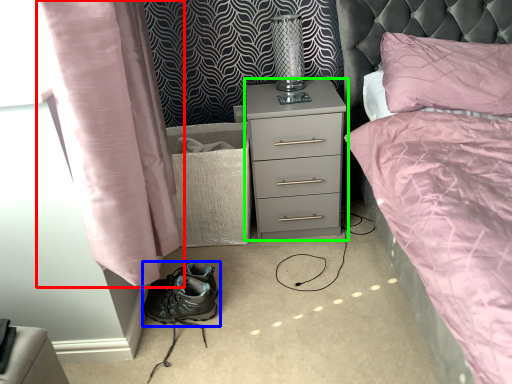
Question: Which object is positioned farthest from curtain (highlighted by a red box)? Select from footwear (highlighted by a blue box) and nightstand (highlighted by a green box).

Choices:
 (A) footwear
 (B) nightstand

Answer: (B)